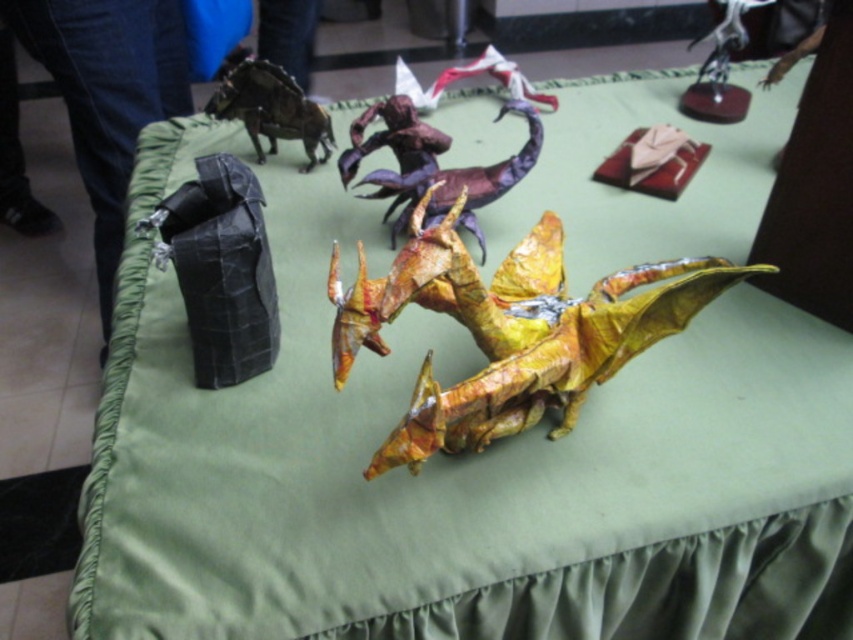
Consider the image. What are the coordinates of the shiny metallic dragon at center?

The shiny metallic dragon at center is located at coordinates point (509, 330).

You are an art curator examining the origami display. You notice the shiny metallic dragon at center and the shiny metallic dinosaur at upper left. Which object is positioned to the right of the other?

The shiny metallic dragon at center is positioned to the right of the shiny metallic dinosaur at upper left.